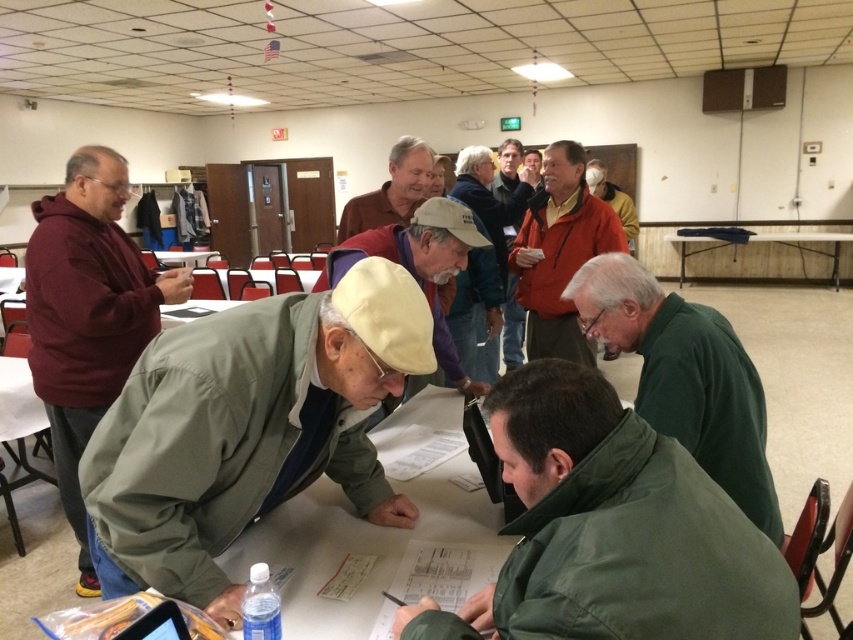
Is point (183, 401) positioned after point (22, 420)?

No, (183, 401) is in front of (22, 420).

Which is behind, point (288, 346) or point (12, 515)?

The point (12, 515) is behind.

This screenshot has height=640, width=853. Identify the location of green matte jacket at center. (247, 429).

Is green matte jacket at lower right positioned behind wooden table at center?

No, green matte jacket at lower right is in front of wooden table at center.

Is green matte jacket at lower right wider than wooden table at center?

No, green matte jacket at lower right is not wider than wooden table at center.

Measure the distance between green matte jacket at lower right and camera.

The distance of green matte jacket at lower right from camera is 4.95 feet.

Identify the location of green matte jacket at lower right. (x=685, y=376).

Is green matte jacket at center shorter than orange softshell jacket at upper right?

Yes.

Can you confirm if green matte jacket at center is positioned to the left of orange softshell jacket at upper right?

Indeed, green matte jacket at center is positioned on the left side of orange softshell jacket at upper right.

Which is behind, point (228, 609) or point (543, 260)?

Point (543, 260)

I want to click on green matte jacket at center, so 247,429.